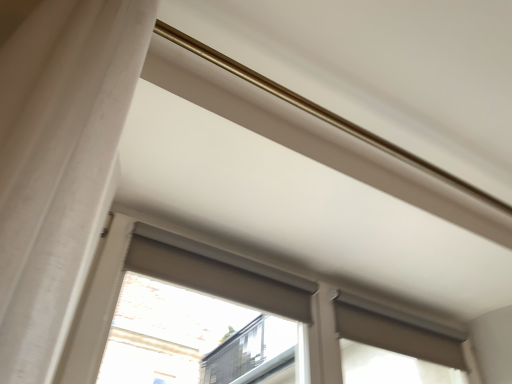
Question: From a real-world perspective, is matte gray roller blind at upper right, which is counted as the 2th window, starting from the top, beneath matte gray roller blind at center, which is the second window in bottom-to-top order?

Choices:
 (A) yes
 (B) no

Answer: (B)

Question: From a real-world perspective, is matte gray roller blind at upper right, which appears as the first window when ordered from the bottom, over matte gray roller blind at center, which is the second window in bottom-to-top order?

Choices:
 (A) yes
 (B) no

Answer: (A)

Question: Is matte gray roller blind at upper right, which is counted as the 2th window, starting from the top, with matte gray roller blind at center, which is the second window in bottom-to-top order?

Choices:
 (A) no
 (B) yes

Answer: (A)

Question: Can you confirm if matte gray roller blind at upper right, which appears as the first window when ordered from the bottom, is positioned to the left of matte gray roller blind at center, which is the second window in bottom-to-top order?

Choices:
 (A) no
 (B) yes

Answer: (A)

Question: Is matte gray roller blind at upper right, which is counted as the 2th window, starting from the top, behind matte gray roller blind at center, which is the second window in bottom-to-top order?

Choices:
 (A) no
 (B) yes

Answer: (B)

Question: Considering the positions of point (232, 263) and point (193, 332), is point (232, 263) closer or farther from the camera than point (193, 332)?

Choices:
 (A) closer
 (B) farther

Answer: (A)

Question: Is matte gray roller blind at center, acting as the 1th window starting from the top, situated inside matte gray roller shade at upper center or outside?

Choices:
 (A) inside
 (B) outside

Answer: (B)

Question: Considering the relative positions of matte gray roller blind at center, which is the second window in bottom-to-top order, and matte gray roller shade at upper center in the image provided, is matte gray roller blind at center, which is the second window in bottom-to-top order, to the left or to the right of matte gray roller shade at upper center?

Choices:
 (A) right
 (B) left

Answer: (A)

Question: Considering the positions of matte gray roller blind at center, acting as the 1th window starting from the top, and matte gray roller shade at upper center in the image, is matte gray roller blind at center, acting as the 1th window starting from the top, taller or shorter than matte gray roller shade at upper center?

Choices:
 (A) short
 (B) tall

Answer: (B)

Question: From a real-world perspective, relative to matte gray roller blind at center, acting as the 1th window starting from the top, is matte gray roller blind at upper right, which is counted as the 2th window, starting from the top, vertically above or below?

Choices:
 (A) above
 (B) below

Answer: (A)

Question: Looking at their shapes, would you say matte gray roller blind at upper right, which appears as the first window when ordered from the bottom, is wider or thinner than matte gray roller blind at center, which is the second window in bottom-to-top order?

Choices:
 (A) thin
 (B) wide

Answer: (B)

Question: In the image, is matte gray roller blind at upper right, which is counted as the 2th window, starting from the top, positioned in front of or behind matte gray roller blind at center, which is the second window in bottom-to-top order?

Choices:
 (A) front
 (B) behind

Answer: (B)

Question: Is point tap(348, 377) positioned closer to the camera than point tap(293, 278)?

Choices:
 (A) closer
 (B) farther

Answer: (B)

Question: Is matte gray roller shade at upper center taller or shorter than matte gray roller blind at upper right, which is counted as the 2th window, starting from the top?

Choices:
 (A) short
 (B) tall

Answer: (A)

Question: From the image's perspective, is matte gray roller shade at upper center above or below matte gray roller blind at upper right, which appears as the first window when ordered from the bottom?

Choices:
 (A) above
 (B) below

Answer: (A)